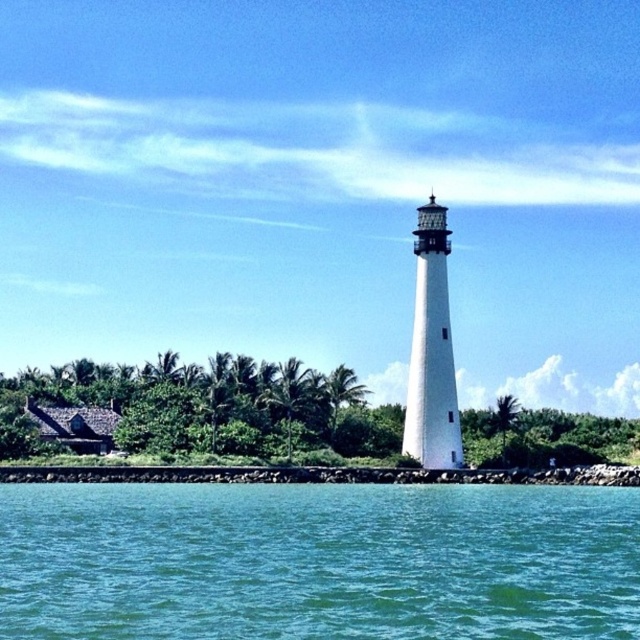
Is clear blue water at lower center wider than white textured lighthouse at center?

Indeed, clear blue water at lower center has a greater width compared to white textured lighthouse at center.

Is point (196, 496) farther from viewer compared to point (452, 435)?

No.

What do you see at coordinates (317, 561) in the screenshot?
I see `clear blue water at lower center` at bounding box center [317, 561].

What are the coordinates of `clear blue water at lower center` in the screenshot? It's located at (317, 561).